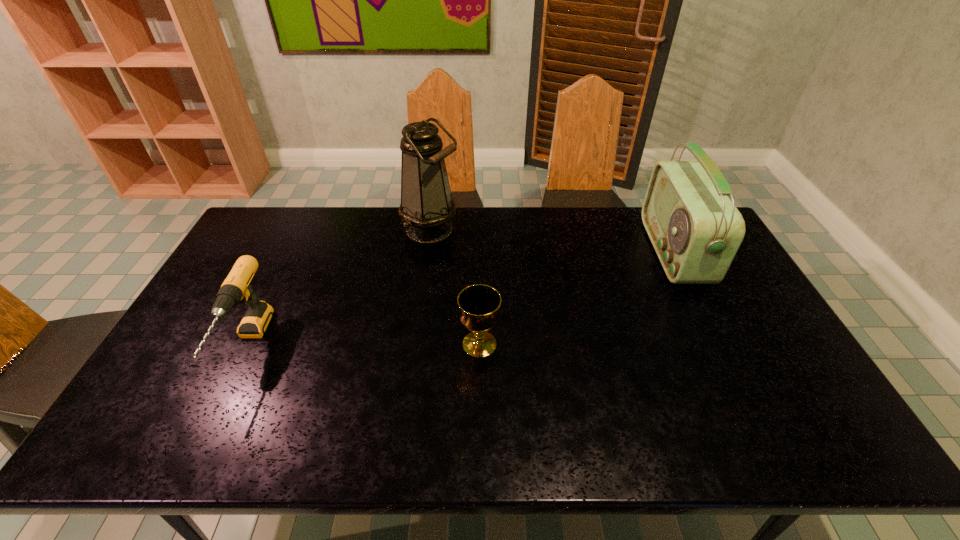
Find the location of a particular element. blank region between the rightmost object and the oil lamp is located at coordinates (552, 241).

You are a GUI agent. You are given a task and a screenshot of the screen. Output one action in this format:
    pyautogui.click(x=<x>, y=<y>)
    Task: Click on the free space between the second object from left to right and the third shortest object
    Image resolution: width=960 pixels, height=540 pixels.
    Given the screenshot: What is the action you would take?
    pyautogui.click(x=552, y=241)

Where is `vacant area between the tallest object and the drill`? vacant area between the tallest object and the drill is located at coordinates (340, 287).

This screenshot has width=960, height=540. Find the location of `free space between the second object from right to left and the tallest object`. free space between the second object from right to left and the tallest object is located at coordinates point(455,287).

This screenshot has height=540, width=960. I want to click on empty space between the radio receiver and the tallest object, so click(x=552, y=241).

What are the coordinates of `free space between the chalice and the rightmost object` in the screenshot? It's located at (577, 298).

This screenshot has width=960, height=540. I want to click on vacant area between the third object from right to left and the chalice, so click(x=455, y=287).

Locate an element on the screen. free space that is in between the radio receiver and the second object from left to right is located at coordinates pyautogui.click(x=552, y=241).

Where is `free space between the radio receiver and the tallest object`? free space between the radio receiver and the tallest object is located at coordinates (552, 241).

This screenshot has height=540, width=960. What are the coordinates of `unoccupied area between the leftmost object and the third object from right to left` in the screenshot? It's located at (340, 287).